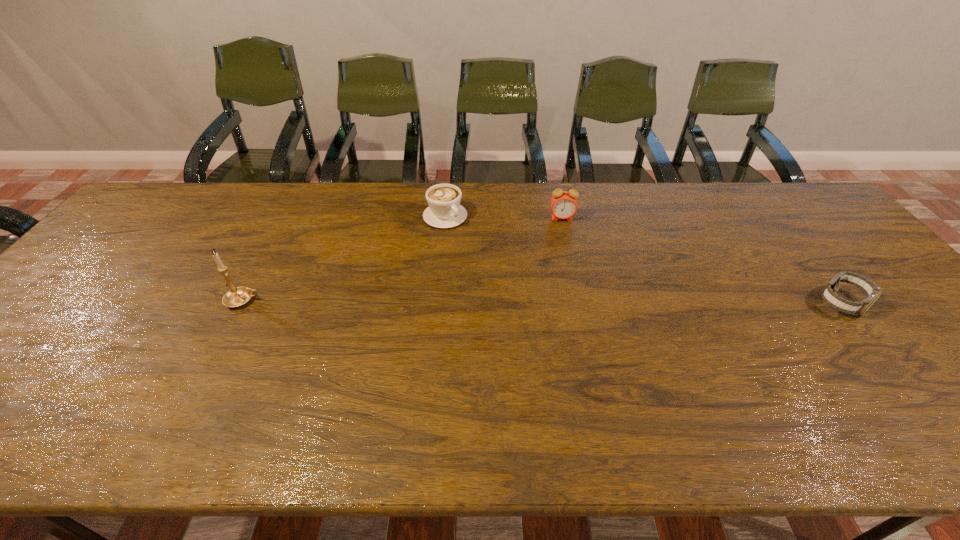
Where is `free location located to the right of the second object from left to right's handle`? free location located to the right of the second object from left to right's handle is located at coordinates (542, 302).

Find the location of `vacant region located to the right of the second object from left to right's handle`. vacant region located to the right of the second object from left to right's handle is located at coordinates (511, 274).

Locate an element on the screen. This screenshot has height=540, width=960. free space located 0.130m to the right of the second object from left to right's handle is located at coordinates (483, 249).

Identify the location of alarm clock that is at the far edge. The height and width of the screenshot is (540, 960). (564, 205).

Image resolution: width=960 pixels, height=540 pixels. I want to click on cappuccino that is at the far edge, so click(x=444, y=211).

Find the location of `object that is at the right edge`. object that is at the right edge is located at coordinates (871, 290).

Image resolution: width=960 pixels, height=540 pixels. In order to click on vacant space at the far edge in this screenshot , I will do `click(672, 184)`.

The image size is (960, 540). I want to click on free space at the near edge, so coord(885,401).

Where is `free space at the left edge`? free space at the left edge is located at coordinates (124, 250).

Find the location of `free space at the right edge`. free space at the right edge is located at coordinates (900, 299).